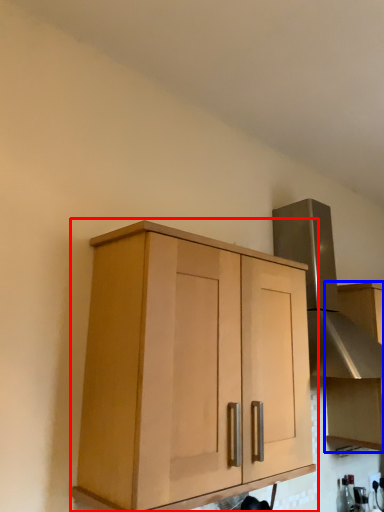
Question: Among these objects, which one is nearest to the camera, cabinetry (highlighted by a red box) or cabinetry (highlighted by a blue box)?

Choices:
 (A) cabinetry
 (B) cabinetry

Answer: (A)